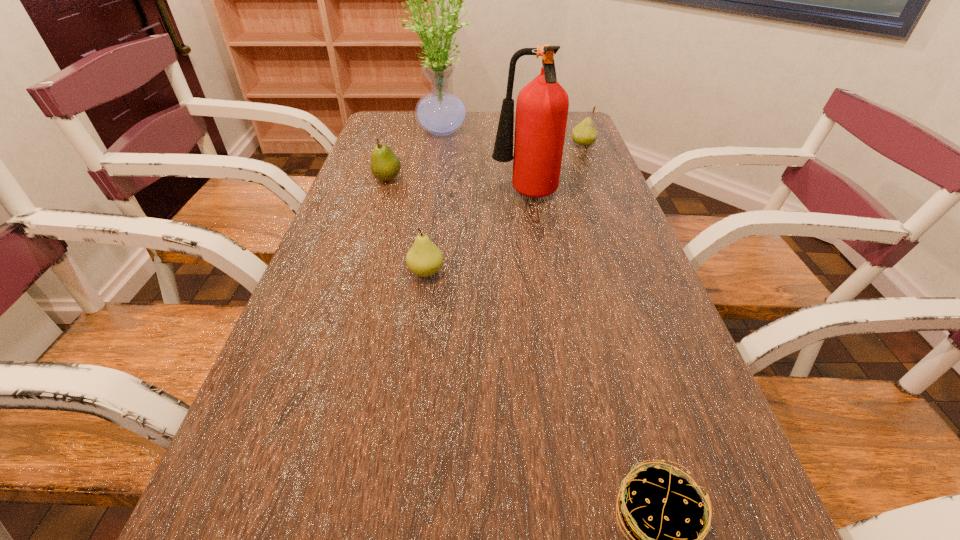
I want to click on vacant area that lies between the tallest object and the second tallest object, so click(485, 163).

Identify which object is the third nearest to the fire extinguisher. Please provide its 2D coordinates. Your answer should be formatted as a tuple, i.e. [(x, y)], where the tuple contains the x and y coordinates of a point satisfying the conditions above.

[(424, 259)]

At what (x,y) coordinates should I click in order to perform the action: click on object identified as the third closest to the tallest object. Please return your answer as a coordinate pair (x, y). Looking at the image, I should click on (584, 134).

Locate which pear is the second closest to the fifth farthest object. Please provide its 2D coordinates. Your answer should be formatted as a tuple, i.e. [(x, y)], where the tuple contains the x and y coordinates of a point satisfying the conditions above.

[(584, 134)]

Where is `pear that is the second closest to the tallest object`? This screenshot has width=960, height=540. pear that is the second closest to the tallest object is located at coordinates (584, 134).

You are a GUI agent. You are given a task and a screenshot of the screen. Output one action in this format:
    pyautogui.click(x=<x>, y=<y>)
    Task: Click on the free region that satisfies the following two spatial constraints: 1. on the back side of the farthest pear; 2. on the right side of the second nearest pear
    The width and height of the screenshot is (960, 540).
    Given the screenshot: What is the action you would take?
    pyautogui.click(x=398, y=144)

This screenshot has width=960, height=540. I want to click on vacant position in the image that satisfies the following two spatial constraints: 1. on the front side of the farthest pear; 2. at the nozzle of the second tallest object, so click(603, 196).

Locate an element on the screen. This screenshot has height=540, width=960. free location that satisfies the following two spatial constraints: 1. on the front side of the second nearest object; 2. on the right side of the tallest object is located at coordinates (425, 272).